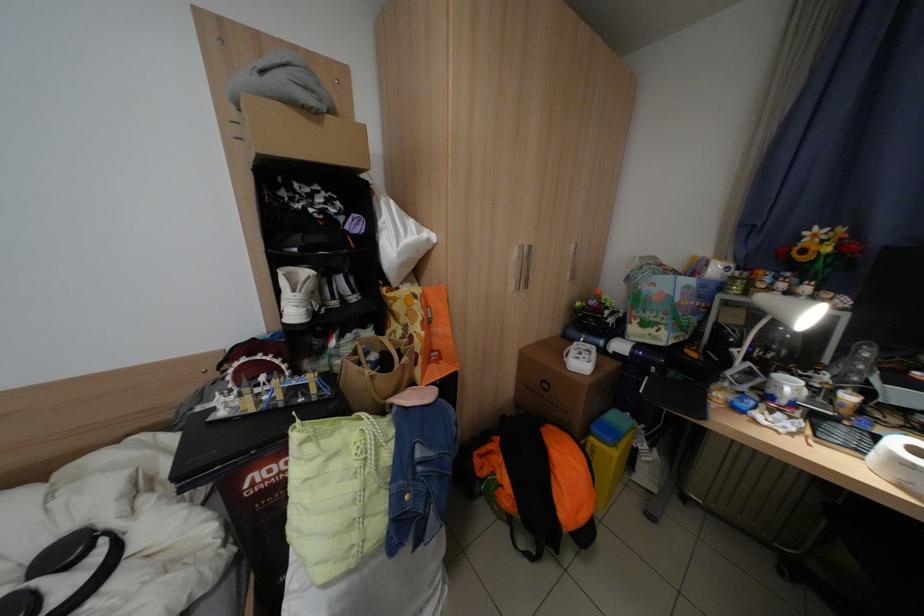
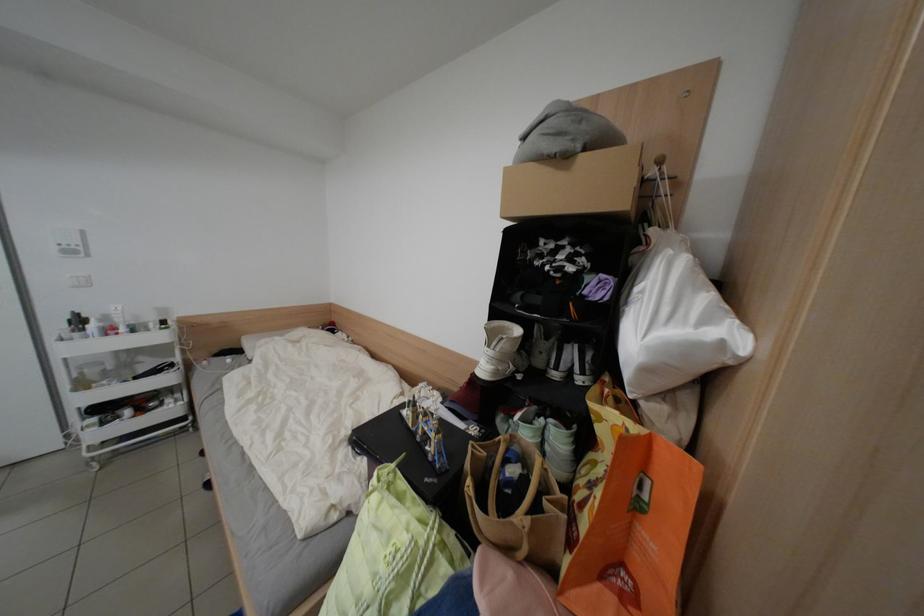
Question: The camera is either moving clockwise (left) or counter-clockwise (right) around the object. The first image is from the beginning of the video and the second image is from the end. Is the camera moving left or right when shooting the video?

Choices:
 (A) Left
 (B) Right

Answer: (B)